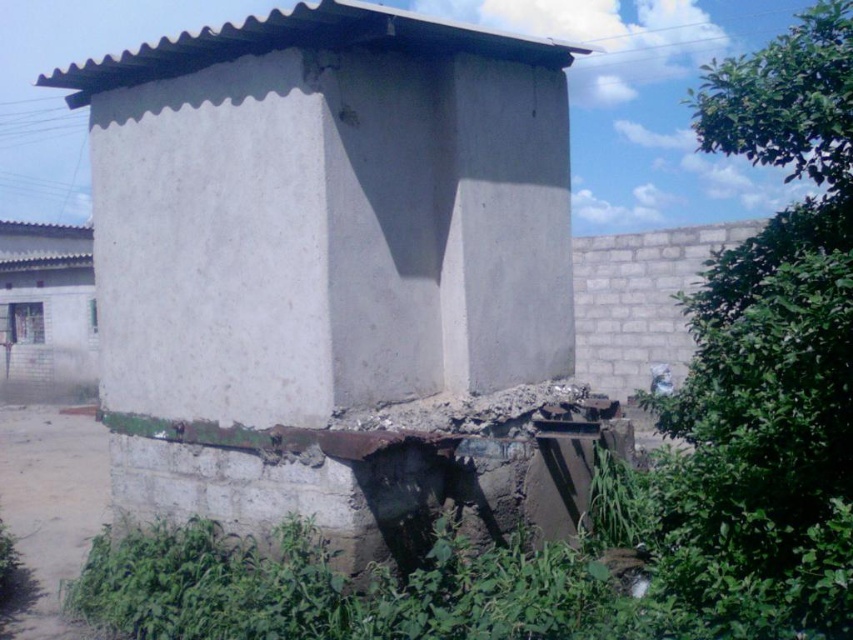
You are planning to build a new shed in your backyard and want to ensure it doesn t take up too much space. You see the white concrete hut at center and the white concrete hut at left in the image. Which one would be a better option for a smaller shed?

The white concrete hut at center occupies less space than the white concrete hut at left, so it would be a better option for a smaller shed.

You are standing in the middle of the scene and want to walk towards the white concrete hut at center. Which direction should you go to avoid passing under the white concrete hut at left?

The white concrete hut at center is positioned under the white concrete hut at left, so to avoid passing under it, you should walk towards the right side of the white concrete hut at left before proceeding to the white concrete hut at center.